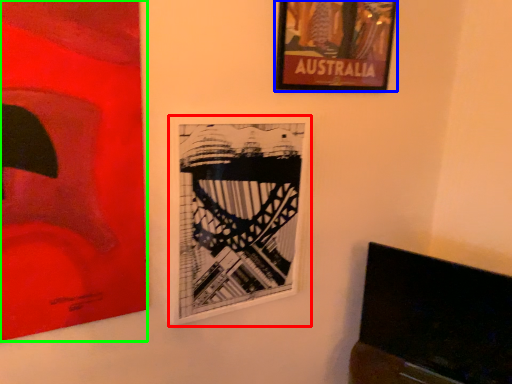
Question: Estimate the real-world distances between objects in this image. Which object is farther from picture frame (highlighted by a red box), picture frame (highlighted by a blue box) or picture frame (highlighted by a green box)?

Choices:
 (A) picture frame
 (B) picture frame

Answer: (A)